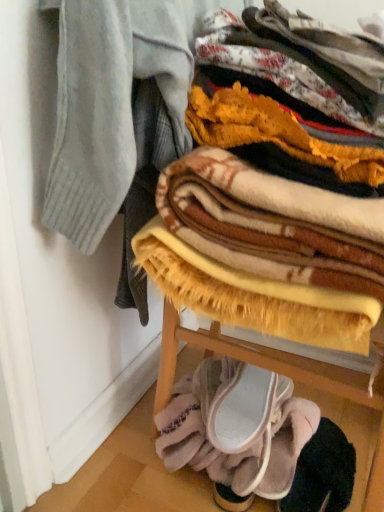
Question: Does pink suede slipper at lower center, placed as the 2th footwear when sorted from bottom to top, have a lesser width compared to pink suede sneakers at lower center, the second footwear from the top?

Choices:
 (A) no
 (B) yes

Answer: (A)

Question: Is pink suede slipper at lower center, which appears as the 1th footwear when viewed from the top, at the right side of pink suede sneakers at lower center, the second footwear from the top?

Choices:
 (A) no
 (B) yes

Answer: (A)

Question: Does pink suede slipper at lower center, which appears as the 1th footwear when viewed from the top, have a lesser height compared to pink suede sneakers at lower center, the second footwear from the top?

Choices:
 (A) yes
 (B) no

Answer: (A)

Question: Is pink suede slipper at lower center, which appears as the 1th footwear when viewed from the top, bigger than pink suede sneakers at lower center, placed as the 1th footwear when sorted from bottom to top?

Choices:
 (A) yes
 (B) no

Answer: (B)

Question: Is pink suede slipper at lower center, which appears as the 1th footwear when viewed from the top, not near pink suede sneakers at lower center, placed as the 1th footwear when sorted from bottom to top?

Choices:
 (A) yes
 (B) no

Answer: (B)

Question: Considering the relative positions of pink suede slipper at lower center, placed as the 2th footwear when sorted from bottom to top, and pink suede sneakers at lower center, placed as the 1th footwear when sorted from bottom to top, in the image provided, is pink suede slipper at lower center, placed as the 2th footwear when sorted from bottom to top, to the left of pink suede sneakers at lower center, placed as the 1th footwear when sorted from bottom to top, from the viewer's perspective?

Choices:
 (A) yes
 (B) no

Answer: (A)

Question: Is plush yellow blanket at center, the 2th blanket ordered from the bottom, turned away from pink suede slipper at lower center, placed as the 2th footwear when sorted from bottom to top?

Choices:
 (A) no
 (B) yes

Answer: (A)

Question: Does plush yellow blanket at center, acting as the first blanket starting from the top, have a greater width compared to pink suede slipper at lower center, which appears as the 1th footwear when viewed from the top?

Choices:
 (A) yes
 (B) no

Answer: (A)

Question: Are plush yellow blanket at center, the 2th blanket ordered from the bottom, and pink suede slipper at lower center, placed as the 2th footwear when sorted from bottom to top, beside each other?

Choices:
 (A) no
 (B) yes

Answer: (A)

Question: Is plush yellow blanket at center, acting as the first blanket starting from the top, closer to the viewer compared to pink suede slipper at lower center, which appears as the 1th footwear when viewed from the top?

Choices:
 (A) no
 (B) yes

Answer: (B)

Question: Is plush yellow blanket at center, acting as the first blanket starting from the top, not near pink suede slipper at lower center, which appears as the 1th footwear when viewed from the top?

Choices:
 (A) no
 (B) yes

Answer: (A)

Question: Is plush yellow blanket at center, the 2th blanket ordered from the bottom, to the left of pink suede slipper at lower center, placed as the 2th footwear when sorted from bottom to top, from the viewer's perspective?

Choices:
 (A) no
 (B) yes

Answer: (A)

Question: Is pink suede sneakers at lower center, placed as the 1th footwear when sorted from bottom to top, not within soft yellow blanket at lower center, the second blanket when ordered from top to bottom?

Choices:
 (A) no
 (B) yes

Answer: (B)